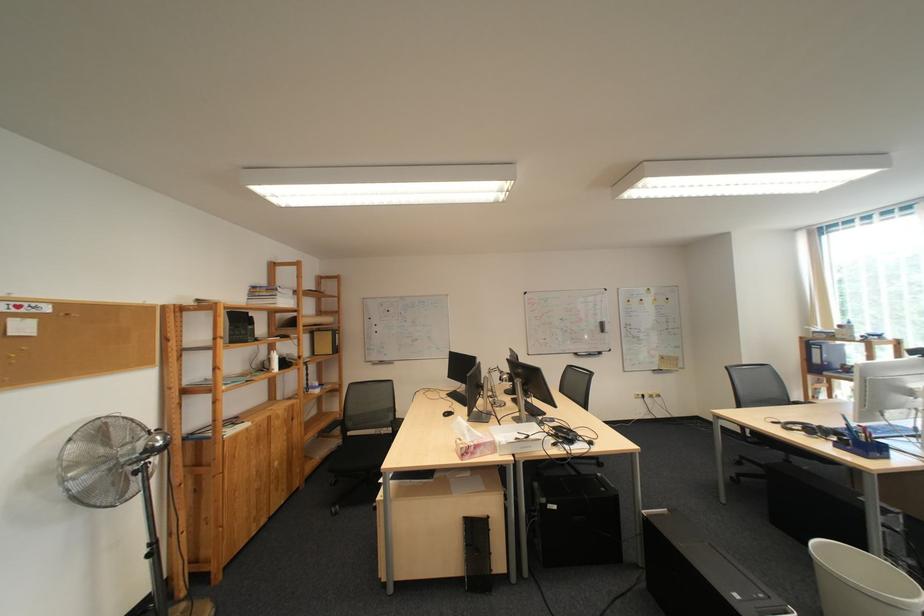
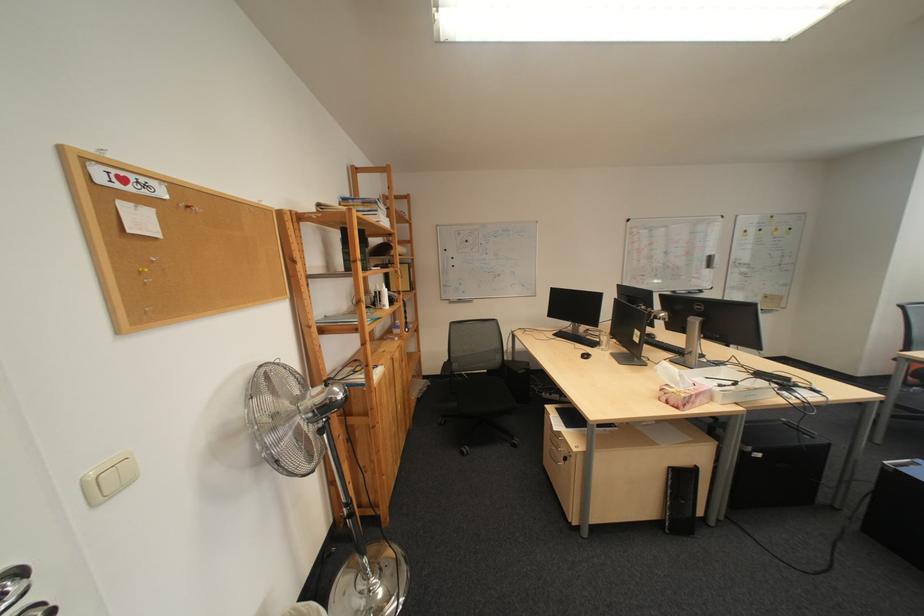
Which direction would the cameraman need to move to produce the second image?

The movement direction of the cameraman is left, forward.